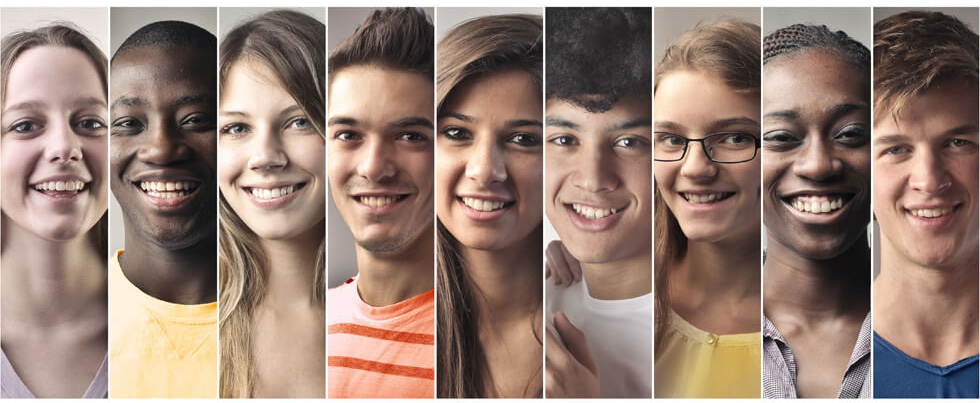
Identify the location of white line between photos. (870, 87), (760, 97), (652, 101), (544, 99), (434, 116), (324, 120), (216, 118), (106, 122).